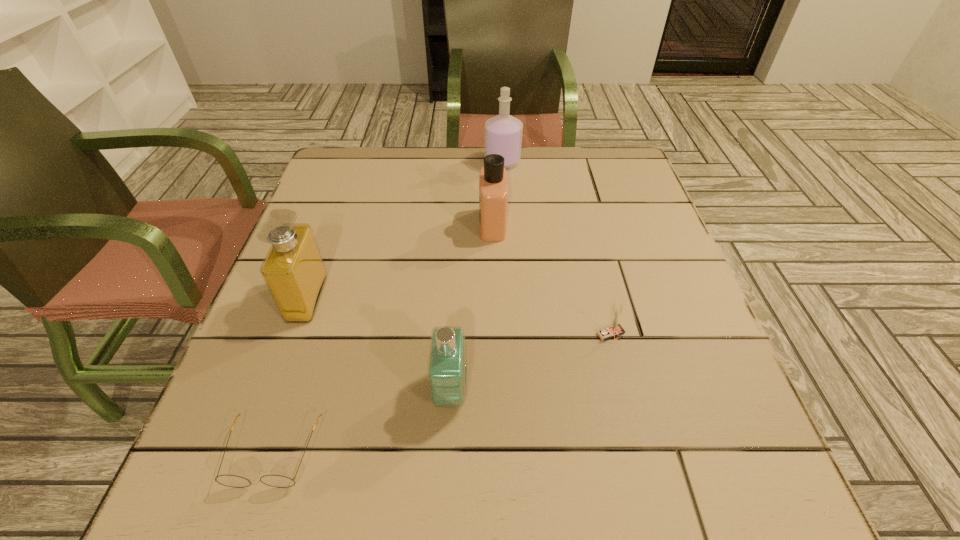
I want to click on perfume that is the fourth closest to the rightmost object, so click(x=503, y=133).

Where is `perfume that is the closest to the leftmost perfume`? perfume that is the closest to the leftmost perfume is located at coordinates (447, 360).

I want to click on free point that satisfies the following two spatial constraints: 1. on the front-facing side of the fourth nearest object; 2. on the back side of the rightmost object, so click(x=294, y=335).

Image resolution: width=960 pixels, height=540 pixels. I want to click on vacant space that satisfies the following two spatial constraints: 1. on the front label of the nearest perfume; 2. on the temples of the spectacles, so click(447, 453).

Locate an element on the screen. This screenshot has height=540, width=960. free space that satisfies the following two spatial constraints: 1. on the front label of the second perfume from left to right; 2. on the temples of the shortest object is located at coordinates (447, 453).

The image size is (960, 540). Find the location of `vacant space that satisfies the following two spatial constraints: 1. on the front label of the matchbox; 2. on the right side of the third nearest perfume`. vacant space that satisfies the following two spatial constraints: 1. on the front label of the matchbox; 2. on the right side of the third nearest perfume is located at coordinates (495, 335).